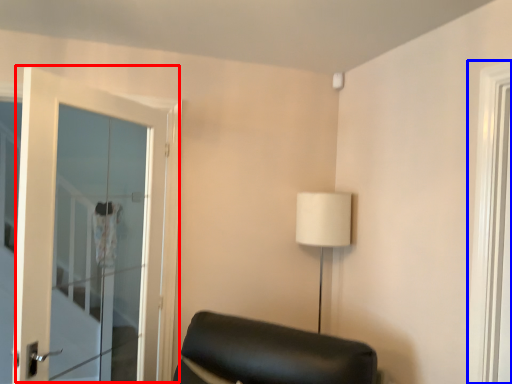
Question: Which object appears closest to the camera in this image, door (highlighted by a red box) or window (highlighted by a blue box)?

Choices:
 (A) door
 (B) window

Answer: (B)